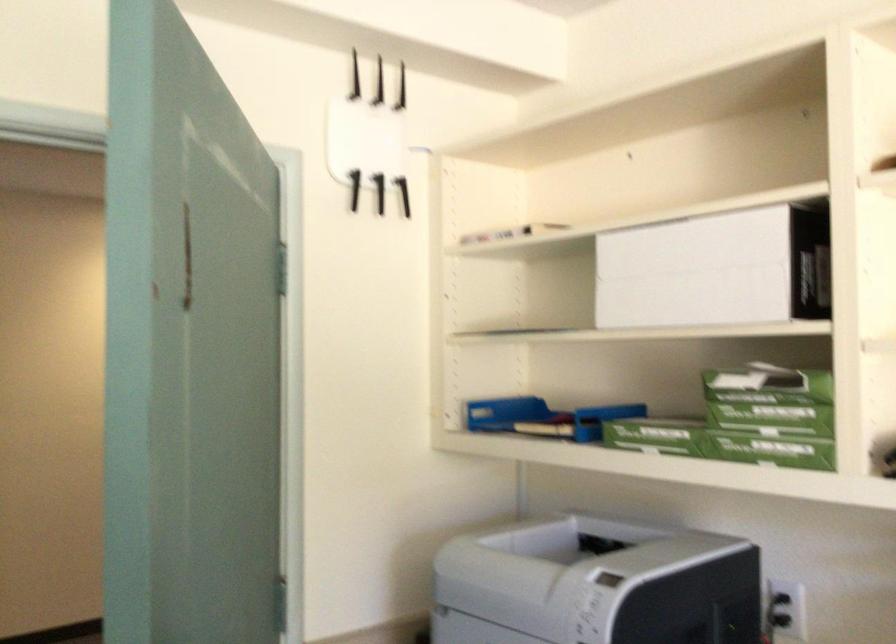
The image size is (896, 644). In order to click on power outlet socket in this screenshot , I will do `click(782, 609)`.